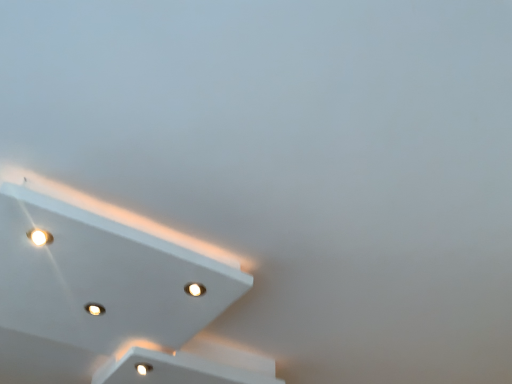
Question: From the image's perspective, is matte white light at upper left, which ranks as the 1th dot in front-to-back order, positioned above or below white glossy light at bottom left, the 2th dot when ordered from front to back?

Choices:
 (A) below
 (B) above

Answer: (B)

Question: In the image, is matte white light at upper left, placed as the 2th dot when sorted from right to left, on the left side or the right side of white glossy light at bottom left, arranged as the first dot when viewed from the back?

Choices:
 (A) left
 (B) right

Answer: (A)

Question: Estimate the real-world distances between objects in this image. Which object is closer to the white glossy light fixture at upper left?

Choices:
 (A) white glossy light at bottom left, the 2th dot in the left-to-right sequence
 (B) matte white light at upper left, which is the first dot from top to bottom

Answer: (A)

Question: Considering the real-world distances, which object is closest to the white glossy light fixture at upper left?

Choices:
 (A) matte white light at upper left, the second dot when ordered from back to front
 (B) white glossy light at bottom left, the 2th dot when ordered from front to back

Answer: (B)